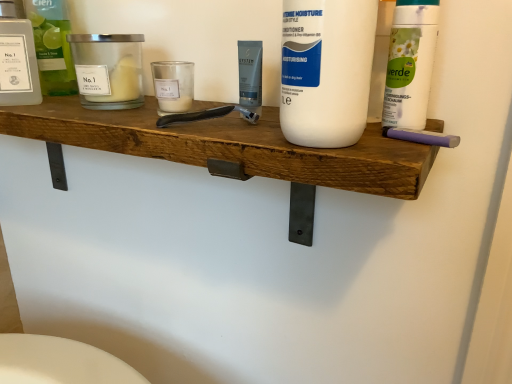
The width and height of the screenshot is (512, 384). Identify the location of free space above wooden shelf at center (from a real-world perspective). (133, 115).